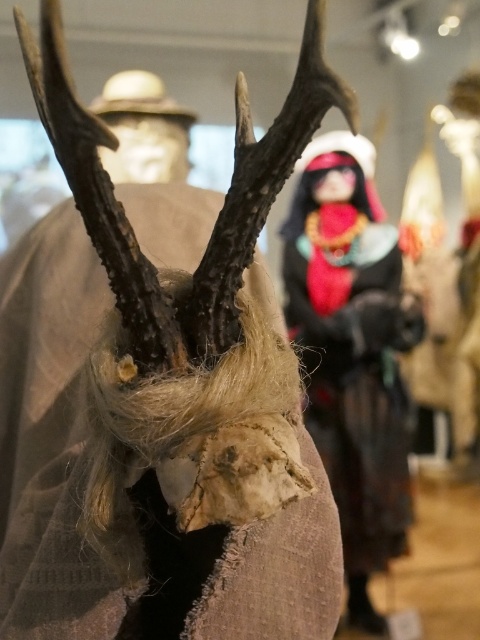
At what (x,y) coordinates should I click in order to perform the action: click on velvet-like doll at center. Please return your answer as a coordinate pair (x, y). The width and height of the screenshot is (480, 640). Looking at the image, I should click on (352, 352).

Which is behind, point (295, 234) or point (187, 132)?

Positioned behind is point (187, 132).

Between point (348, 307) and point (131, 177), which one is positioned in front?

Point (348, 307) is more forward.

Identify the location of velvet-like doll at center. The width and height of the screenshot is (480, 640). (352, 352).

Which is behind, point (220, 636) or point (314, 266)?

Point (314, 266)

Who is more forward, [180,243] or [380,268]?

Point [180,243] is in front.

Where is `brown textured antlers at center`? The width and height of the screenshot is (480, 640). brown textured antlers at center is located at coordinates (160, 401).

Where is `brown textured antlers at center`? brown textured antlers at center is located at coordinates (160, 401).

Does brown textured antlers at center have a lesser width compared to matte beige hat at upper center?

No.

Does point (155, 460) lie behind point (144, 120)?

No, it is in front of (144, 120).

Identify the location of brown textured antlers at center. The height and width of the screenshot is (640, 480). (160, 401).